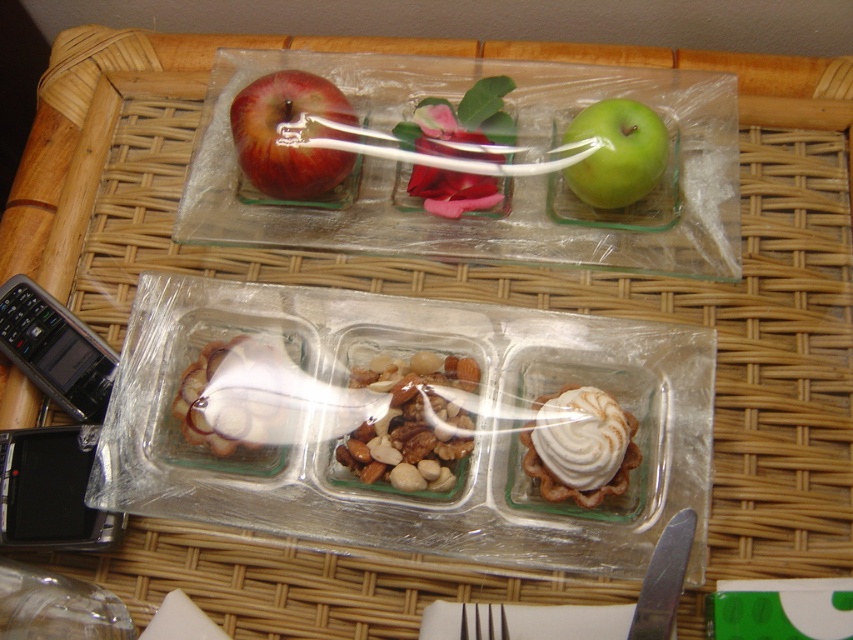
You are arranging a picnic basket and see the shiny red apple at upper left and the shiny brown nuts at center in the trays. Which item is positioned to the right of the other?

The shiny brown nuts at center are to the right of the shiny red apple at upper left.

You are holding a 10 inch long ruler. If you want to measure the distance from the viewer to the point at coordinates point (x=567, y=467), can your ruler reach that point?

The point point (x=567, y=467) is 22.18 inches from the viewer. Since your ruler is only 10 inches long, it cannot reach that distance.

You are a customer at a bakery and see the whipped cream pastry at center right and the green matte apple at upper right on the display. Which item is located below the other?

The whipped cream pastry at center right is positioned under the green matte apple at upper right.